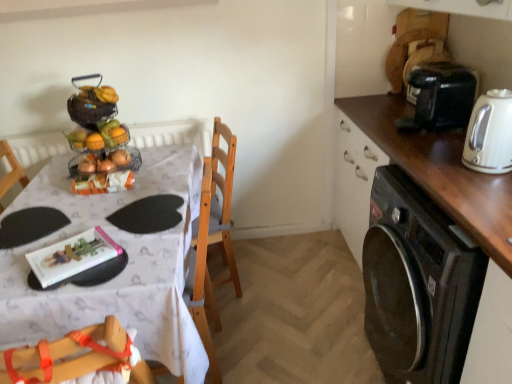
This screenshot has width=512, height=384. Identify the location of vacant area that lies in front of wooden chair at center, the second chair viewed from the front. (247, 319).